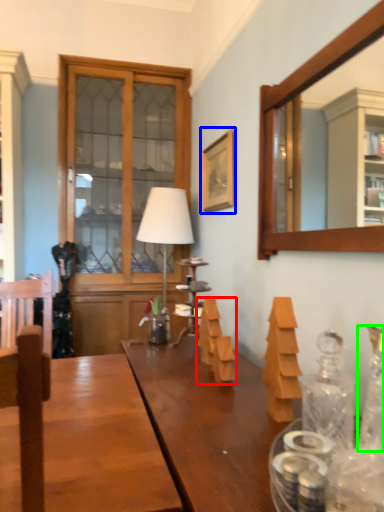
Question: Considering the real-world distances, which object is closest to wood (highlighted by a red box)? picture frame (highlighted by a blue box) or bottle (highlighted by a green box).

Choices:
 (A) picture frame
 (B) bottle

Answer: (B)